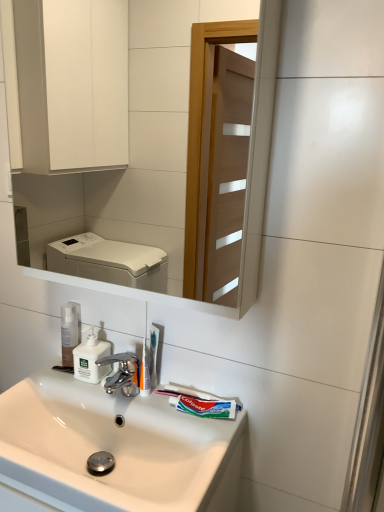
Question: Can you confirm if white plastic toothbrush at center, which appears as the 2th toothbrush when viewed from the back, is positioned to the left of white glossy sink at lower center?

Choices:
 (A) yes
 (B) no

Answer: (B)

Question: Could you tell me if white plastic toothbrush at center, which appears as the 2th toothbrush when viewed from the back, is turned towards white glossy sink at lower center?

Choices:
 (A) yes
 (B) no

Answer: (B)

Question: From the image's perspective, is white plastic toothbrush at center, which appears as the 2th toothbrush when viewed from the back, above white glossy sink at lower center?

Choices:
 (A) no
 (B) yes

Answer: (B)

Question: Is white plastic toothbrush at center, which appears as the 2th toothbrush when viewed from the back, shorter than white glossy sink at lower center?

Choices:
 (A) no
 (B) yes

Answer: (B)

Question: Is white plastic toothbrush at center, which is the 1th toothbrush from front to back, positioned beyond the bounds of white glossy sink at lower center?

Choices:
 (A) no
 (B) yes

Answer: (B)

Question: From the image's perspective, is white plastic toothbrush at center, which appears as the 2th toothbrush when viewed from the back, below white glossy sink at lower center?

Choices:
 (A) no
 (B) yes

Answer: (A)

Question: Can you confirm if white glossy mirror at upper center is bigger than white glossy sink at lower center?

Choices:
 (A) no
 (B) yes

Answer: (B)

Question: From the image's perspective, is white glossy mirror at upper center below white glossy sink at lower center?

Choices:
 (A) no
 (B) yes

Answer: (A)

Question: Does white glossy mirror at upper center have a greater width compared to white glossy sink at lower center?

Choices:
 (A) yes
 (B) no

Answer: (B)

Question: Does white glossy mirror at upper center have a lesser height compared to white glossy sink at lower center?

Choices:
 (A) yes
 (B) no

Answer: (B)

Question: Can you confirm if white glossy mirror at upper center is positioned to the left of white glossy sink at lower center?

Choices:
 (A) yes
 (B) no

Answer: (B)

Question: Does white glossy mirror at upper center have a greater height compared to white glossy sink at lower center?

Choices:
 (A) yes
 (B) no

Answer: (A)

Question: Can you confirm if white glossy sink at lower center is thinner than white plastic toothbrush at center, marked as the first toothbrush in a back-to-front arrangement?

Choices:
 (A) no
 (B) yes

Answer: (A)